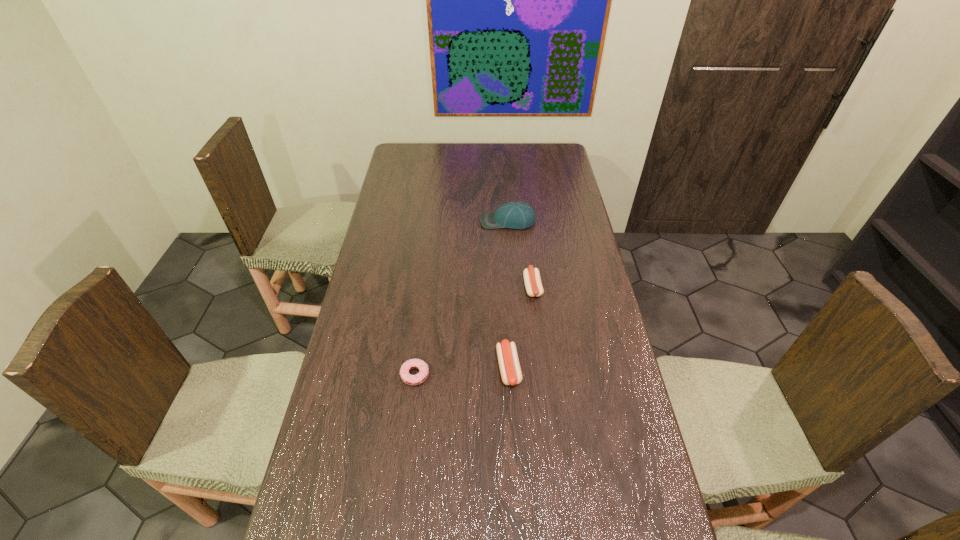
This screenshot has height=540, width=960. I want to click on vacant space located on the left of the shortest object, so click(358, 375).

Locate an element on the screen. Image resolution: width=960 pixels, height=540 pixels. vacant area at the far edge is located at coordinates (457, 154).

In the image, there is a desktop. At what (x,y) coordinates should I click in order to perform the action: click on free space at the left edge. Please return your answer as a coordinate pair (x, y). Looking at the image, I should click on (380, 410).

Where is `blank space at the right edge of the desktop`? blank space at the right edge of the desktop is located at coordinates (621, 447).

This screenshot has width=960, height=540. Find the location of `vacant area at the far left corner of the desktop`. vacant area at the far left corner of the desktop is located at coordinates (399, 164).

In the image, there is a desktop. Where is `vacant space at the far right corner`? Image resolution: width=960 pixels, height=540 pixels. vacant space at the far right corner is located at coordinates (535, 149).

The width and height of the screenshot is (960, 540). Identify the location of vacant space in between the left sausage and the right sausage. (520, 327).

Where is `empty location between the nearer sausage and the shortest object`? The width and height of the screenshot is (960, 540). empty location between the nearer sausage and the shortest object is located at coordinates (462, 372).

I want to click on free spot between the farthest object and the nearer sausage, so click(508, 294).

Find the location of a particular element. Image resolution: width=960 pixels, height=540 pixels. empty space between the right sausage and the nearer sausage is located at coordinates (520, 327).